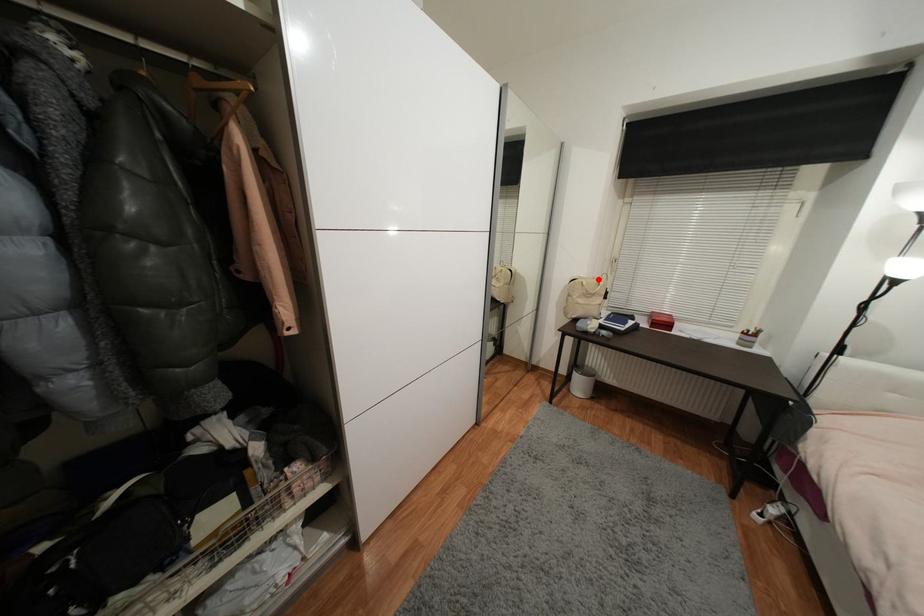
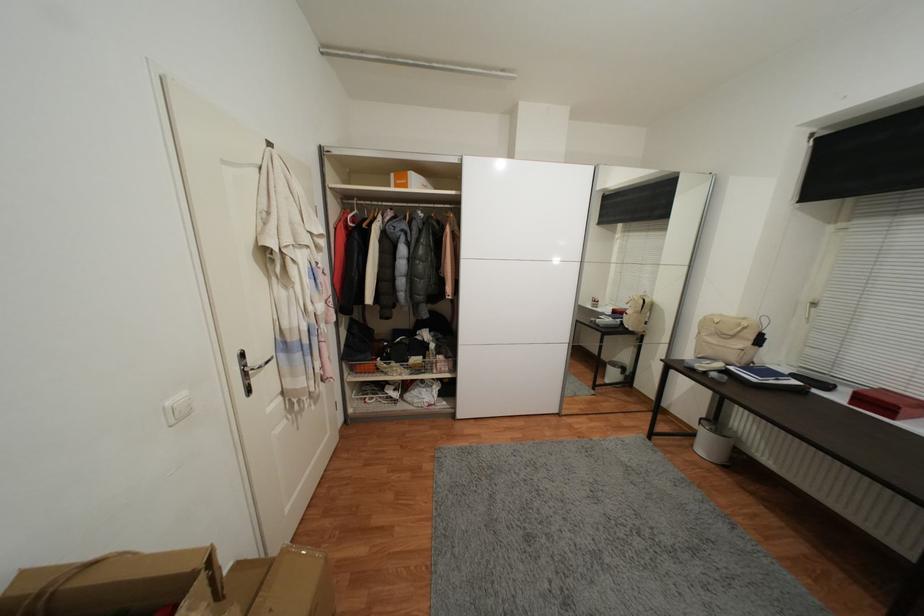
Question: I am providing you with two images of the same scene from different viewpoints. Given a red point in image1, look at the same physical point in image2. Is it:

Choices:
 (A) Closer to the viewpoint
 (B) Farther from the viewpoint

Answer: (B)